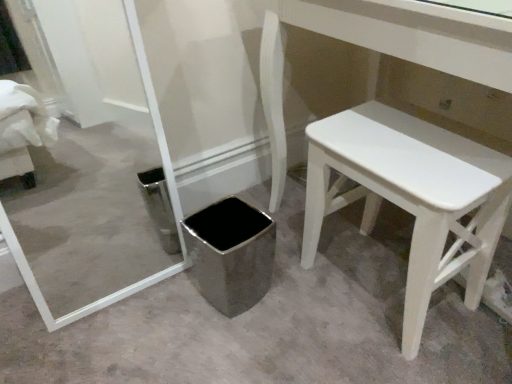
What do you see at coordinates (411, 196) in the screenshot?
I see `white painted wood stool at lower right` at bounding box center [411, 196].

Where is `white painted wood stool at lower right`? The width and height of the screenshot is (512, 384). white painted wood stool at lower right is located at coordinates (411, 196).

This screenshot has height=384, width=512. I want to click on polished stainless steel trash can at center, so click(x=231, y=254).

What do you see at coordinates (231, 254) in the screenshot? The width and height of the screenshot is (512, 384). I see `polished stainless steel trash can at center` at bounding box center [231, 254].

In order to click on white painted wood stool at lower right in this screenshot , I will do [x=411, y=196].

Can you confirm if polished stainless steel trash can at center is positioned to the right of white painted wood stool at lower right?

No, polished stainless steel trash can at center is not to the right of white painted wood stool at lower right.

Which object is closer to the camera taking this photo, polished stainless steel trash can at center or white painted wood stool at lower right?

white painted wood stool at lower right is in front.

Is point (210, 295) closer to camera compared to point (310, 156)?

No.

From the image's perspective, is polished stainless steel trash can at center under white painted wood stool at lower right?

Correct, polished stainless steel trash can at center appears lower than white painted wood stool at lower right in the image.

From a real-world perspective, between polished stainless steel trash can at center and white painted wood stool at lower right, who is vertically higher?

white painted wood stool at lower right.

Considering the relative sizes of polished stainless steel trash can at center and white painted wood stool at lower right in the image provided, is polished stainless steel trash can at center thinner than white painted wood stool at lower right?

Yes, polished stainless steel trash can at center is thinner than white painted wood stool at lower right.

Between polished stainless steel trash can at center and white painted wood stool at lower right, which one has more height?

With more height is white painted wood stool at lower right.

Based on the photo, who is smaller, polished stainless steel trash can at center or white painted wood stool at lower right?

With smaller size is polished stainless steel trash can at center.

Looking at this image, is polished stainless steel trash can at center located outside white painted wood stool at lower right?

Yes.

Is polished stainless steel trash can at center far from white painted wood stool at lower right?

polished stainless steel trash can at center is actually quite close to white painted wood stool at lower right.

Could you tell me if polished stainless steel trash can at center is facing white painted wood stool at lower right?

No, polished stainless steel trash can at center does not turn towards white painted wood stool at lower right.

Image resolution: width=512 pixels, height=384 pixels. I want to click on potty below the white painted wood stool at lower right (from the image's perspective), so click(x=231, y=254).

Which is more to the right, white painted wood stool at lower right or polished stainless steel trash can at center?

Positioned to the right is white painted wood stool at lower right.

Which object is closer to the camera taking this photo, white painted wood stool at lower right or polished stainless steel trash can at center?

Positioned in front is white painted wood stool at lower right.

Is point (407, 199) positioned after point (219, 311)?

No, it is not.

From the image's perspective, does white painted wood stool at lower right appear higher than polished stainless steel trash can at center?

Correct, white painted wood stool at lower right appears higher than polished stainless steel trash can at center in the image.

From a real-world perspective, is white painted wood stool at lower right located beneath polished stainless steel trash can at center?

No.

Considering the sizes of objects white painted wood stool at lower right and polished stainless steel trash can at center in the image provided, who is thinner, white painted wood stool at lower right or polished stainless steel trash can at center?

polished stainless steel trash can at center is thinner.

Based on the photo, is white painted wood stool at lower right taller than polished stainless steel trash can at center?

Indeed, white painted wood stool at lower right has a greater height compared to polished stainless steel trash can at center.

Does white painted wood stool at lower right have a smaller size compared to polished stainless steel trash can at center?

No, white painted wood stool at lower right is not smaller than polished stainless steel trash can at center.

Which is correct: white painted wood stool at lower right is inside polished stainless steel trash can at center, or outside of it?

white painted wood stool at lower right is not inside polished stainless steel trash can at center, it's outside.

Would you consider white painted wood stool at lower right to be distant from polished stainless steel trash can at center?

No, white painted wood stool at lower right is not far away from polished stainless steel trash can at center.

Is white painted wood stool at lower right aimed at polished stainless steel trash can at center?

Yes, white painted wood stool at lower right faces towards polished stainless steel trash can at center.

How distant is white painted wood stool at lower right from polished stainless steel trash can at center?

white painted wood stool at lower right is 12.77 inches from polished stainless steel trash can at center.

Locate an element on the screen. This screenshot has height=384, width=512. stool that appears above the polished stainless steel trash can at center (from a real-world perspective) is located at coordinates (411, 196).

This screenshot has height=384, width=512. In order to click on stool lying on the right of polished stainless steel trash can at center in this screenshot , I will do `click(411, 196)`.

Image resolution: width=512 pixels, height=384 pixels. Identify the location of potty that appears behind the white painted wood stool at lower right. (231, 254).